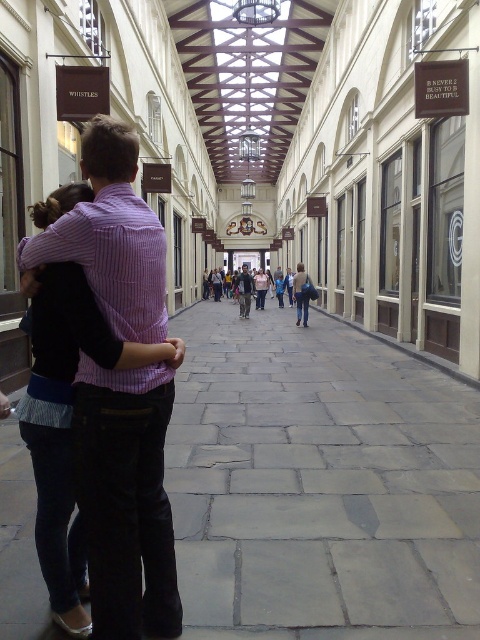
You are a photographer setting up a tripod in the arcade. You need to ensure that the black denim jeans at left and the matte pink shirt at center are both visible in the frame. Given their heights, which object should you adjust the camera angle to focus on first to include both?

The black denim jeans at left is shorter than the matte pink shirt at center, so you should lower the camera angle to focus on the black denim jeans at left first, ensuring it remains in view while capturing the taller matte pink shirt at center.